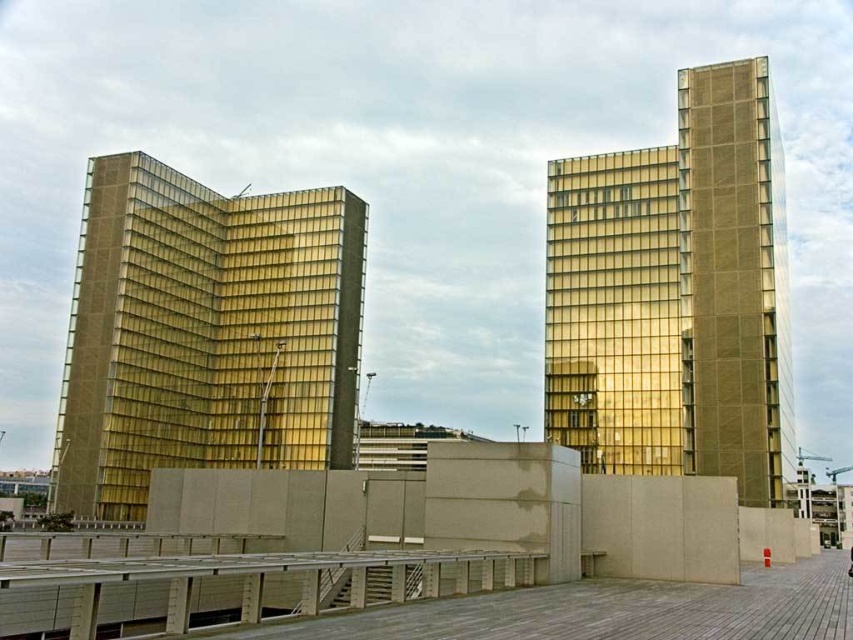
This screenshot has height=640, width=853. I want to click on gold glass building at left, so click(206, 333).

Can you confirm if gold glass building at left is shorter than gold glass building at upper right?

Incorrect, gold glass building at left's height does not fall short of gold glass building at upper right's.

Identify the location of gold glass building at left. The width and height of the screenshot is (853, 640). (206, 333).

Image resolution: width=853 pixels, height=640 pixels. In order to click on gold glass building at left in this screenshot , I will do `click(206, 333)`.